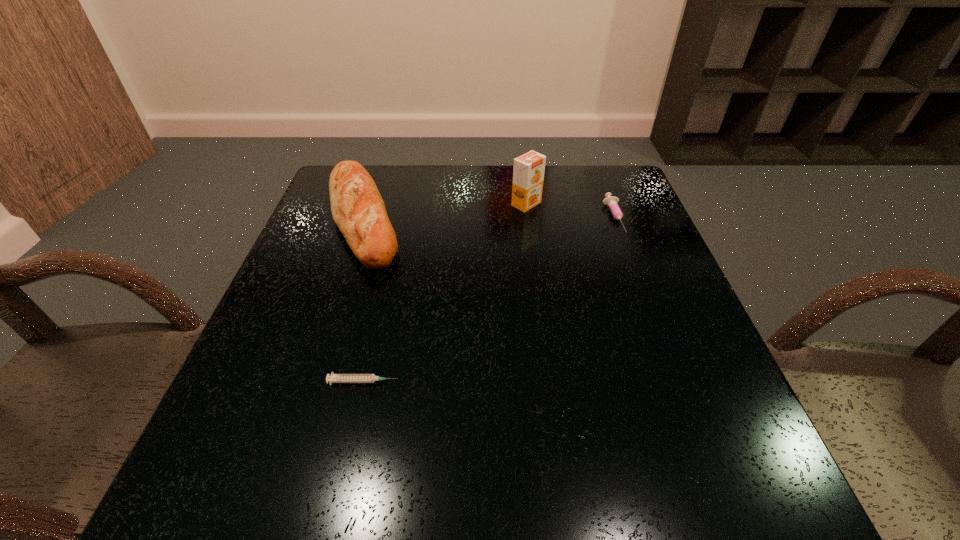
Find the location of a particular element. This screenshot has width=960, height=540. vacant position located 0.050m at the needle end of the left syringe is located at coordinates (428, 382).

This screenshot has width=960, height=540. What are the coordinates of `orange juice present at the far edge` in the screenshot? It's located at (528, 172).

Locate an element on the screen. baguet present at the far edge is located at coordinates (358, 210).

Where is `syringe that is at the far edge`? The height and width of the screenshot is (540, 960). syringe that is at the far edge is located at coordinates (612, 202).

The width and height of the screenshot is (960, 540). What are the coordinates of `baguet positioned at the left edge` in the screenshot? It's located at (358, 210).

At what (x,y) coordinates should I click in order to perform the action: click on syringe at the left edge. Please return your answer as a coordinate pair (x, y). Looking at the image, I should click on (333, 378).

What are the coordinates of `object that is at the right edge` in the screenshot? It's located at (612, 202).

This screenshot has height=540, width=960. In order to click on object that is at the far left corner in this screenshot , I will do `click(358, 210)`.

Where is `object present at the far right corner`? The width and height of the screenshot is (960, 540). object present at the far right corner is located at coordinates (612, 202).

This screenshot has height=540, width=960. In the image, there is a desktop. In order to click on vacant space at the far edge in this screenshot , I will do `click(555, 198)`.